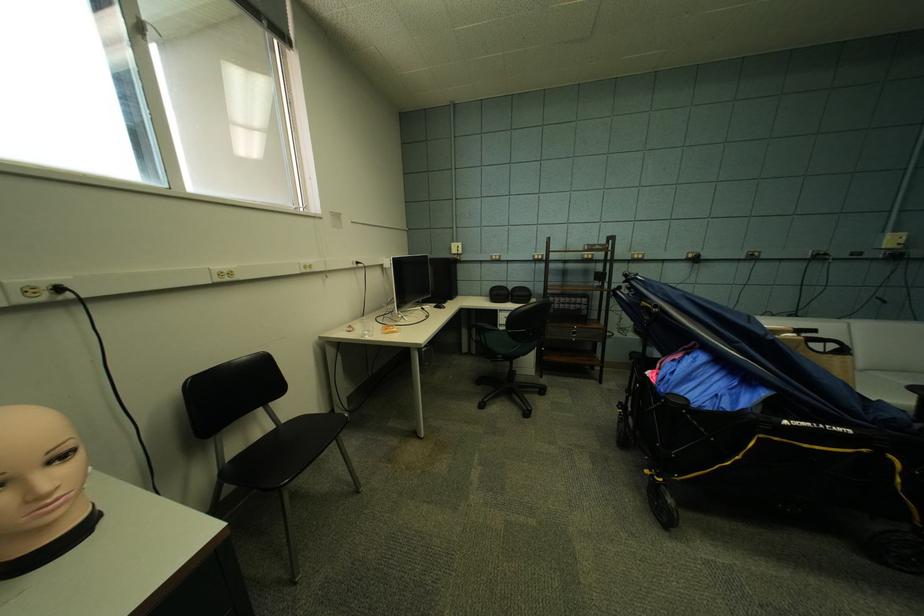
Locate an element on the screen. The image size is (924, 616). window latch is located at coordinates (148, 31).